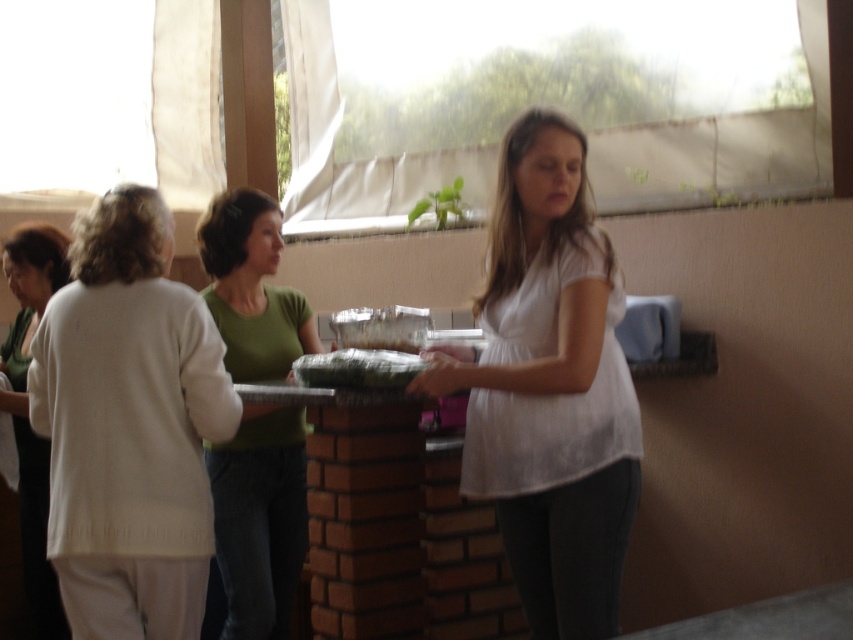
Question: Which point is farther to the camera?

Choices:
 (A) green matte food at center
 (B) white knit sweater at left
 (C) green matte shirt at center
 (D) white matte shirt at center

Answer: (C)

Question: Is green matte shirt at center smaller than green matte food at center?

Choices:
 (A) no
 (B) yes

Answer: (A)

Question: Is white sweater at left to the right of green matte food at center from the viewer's perspective?

Choices:
 (A) no
 (B) yes

Answer: (A)

Question: Which point appears farthest from the camera in this image?

Choices:
 (A) (492, 298)
 (B) (231, 394)
 (C) (397, 362)
 (D) (231, 522)

Answer: (D)

Question: Is the position of green matte shirt at center less distant than that of white sweater at left?

Choices:
 (A) yes
 (B) no

Answer: (A)

Question: Which object appears farthest from the camera in this image?

Choices:
 (A) green matte shirt at center
 (B) white matte shirt at center
 (C) white knit sweater at left

Answer: (A)